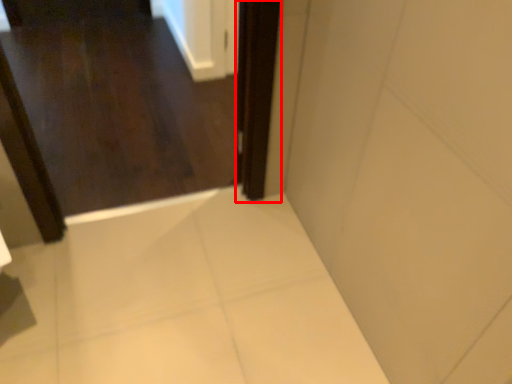
Question: From the image's perspective, where is screen door (annotated by the red box) located relative to door?

Choices:
 (A) above
 (B) below

Answer: (B)